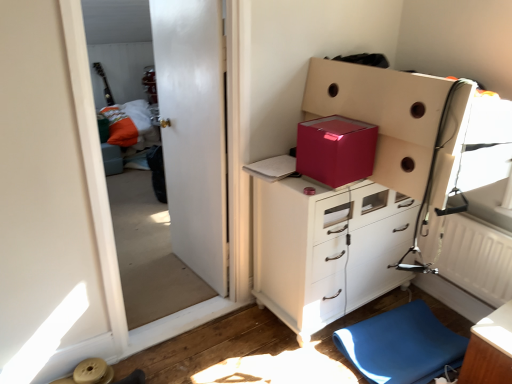
Question: Considering the positions of white glossy door at upper left and matte white cabinet at center in the image, is white glossy door at upper left bigger or smaller than matte white cabinet at center?

Choices:
 (A) big
 (B) small

Answer: (B)

Question: Is white glossy door at upper left to the left or to the right of matte white cabinet at center in the image?

Choices:
 (A) right
 (B) left

Answer: (B)

Question: Considering the real-world distances, which object is farthest from the glossy cardboard box at upper center, which ranks as the second cardboard box in right-to-left order?

Choices:
 (A) matte white cabinet at center
 (B) wooden table at lower right
 (C) white textured radiator at lower right
 (D) matte pink cardboard box at upper right, placed as the second cardboard box when sorted from left to right
 (E) blue rubber mat at lower right

Answer: (B)

Question: Which object is positioned farthest from the white textured radiator at lower right?

Choices:
 (A) matte white cabinet at center
 (B) blue rubber mat at lower right
 (C) glossy cardboard box at upper center, which is counted as the first cardboard box, starting from the left
 (D) orange fabric bed at left
 (E) wooden table at lower right

Answer: (D)